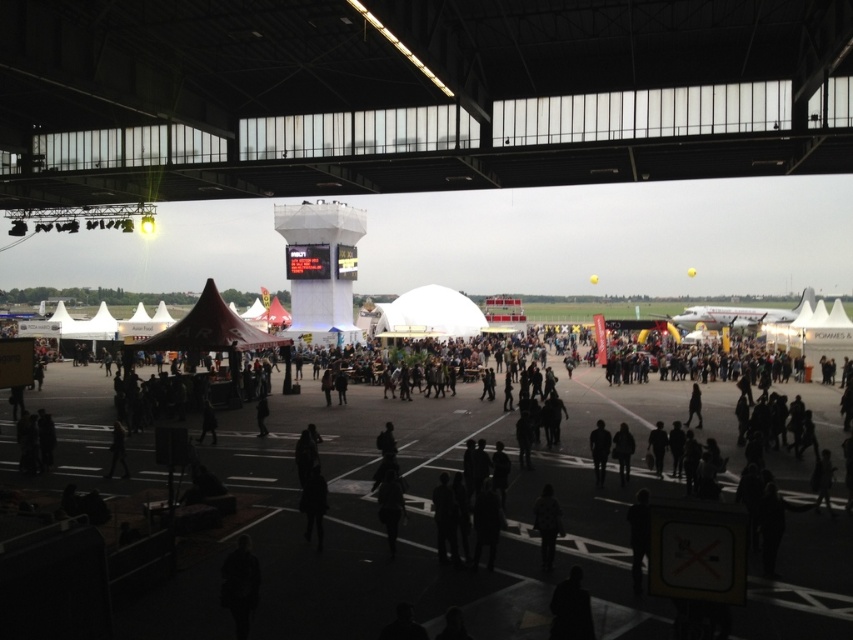
You are organizing a small event and need to place a 1.5 meter wide booth in the space. Given the dark asphalt tarmac at center and the dark fabric jacket at center, which object can accommodate the booth based on their widths?

The dark asphalt tarmac at center can accommodate the booth since its width is larger than the dark fabric jacket at center and the booth is 1.5 meters wide.